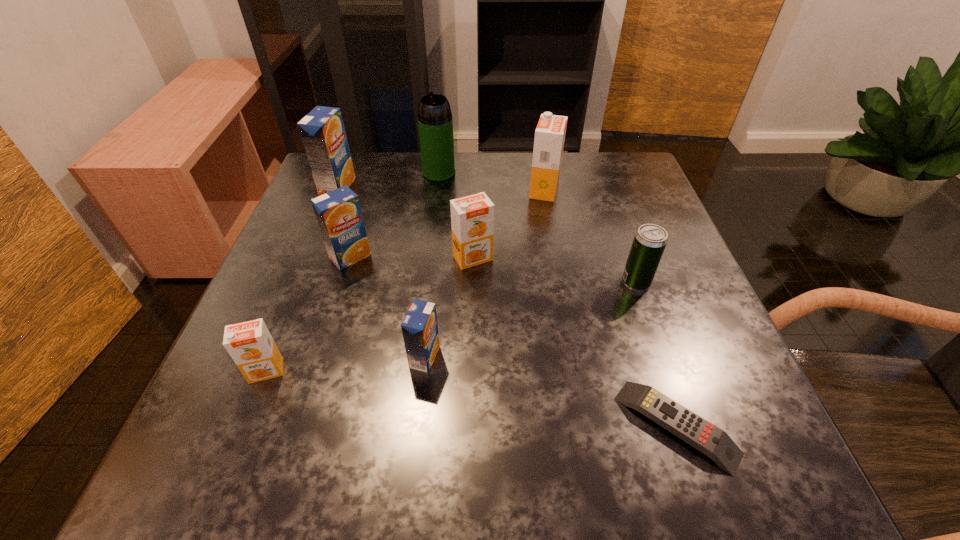
This screenshot has height=540, width=960. I want to click on the fifth closest object to the green thermos bottle, so click(650, 240).

This screenshot has width=960, height=540. I want to click on the third closest orange juice to the sixth farthest object, so click(x=419, y=328).

Find the location of a particular element. Image resolution: width=960 pixels, height=540 pixels. orange juice that is the third closest to the leftmost orange orange juice is located at coordinates (472, 217).

Image resolution: width=960 pixels, height=540 pixels. Find the location of `blue orange_juice that stands as the second closest to the beer can`. blue orange_juice that stands as the second closest to the beer can is located at coordinates (338, 213).

Where is `blue orange_juice that is the closest to the second smallest blue orange_juice`? This screenshot has width=960, height=540. blue orange_juice that is the closest to the second smallest blue orange_juice is located at coordinates (322, 131).

You are a GUI agent. You are given a task and a screenshot of the screen. Output one action in this format:
    pyautogui.click(x=<x>, y=<y>)
    Task: Click on the closest orange orange juice to the farthest orange orange juice
    
    Given the screenshot: What is the action you would take?
    pyautogui.click(x=472, y=217)

Find the location of a particular element. orange orange juice that stands as the second closest to the second blue orange_juice from right to left is located at coordinates (250, 344).

You are a GUI agent. You are given a task and a screenshot of the screen. Output one action in this format:
    pyautogui.click(x=<x>, y=<y>)
    Task: Click on the vacant area that satisfies the following two spatial constraints: 1. from the spout of the green thermos bottle; 2. on the left side of the second orange juice from right to left
    
    Given the screenshot: What is the action you would take?
    pyautogui.click(x=429, y=258)

Where is `vacant area in the image that satisfies the following two spatial constraints: 1. from the spout of the green thermos bottle; 2. on the left side of the remote control`? This screenshot has width=960, height=540. vacant area in the image that satisfies the following two spatial constraints: 1. from the spout of the green thermos bottle; 2. on the left side of the remote control is located at coordinates (409, 426).

At what (x,y) coordinates should I click in order to perform the action: click on free space in the image that satisfies the following two spatial constraints: 1. on the back side of the third orange juice from right to left; 2. on the left side of the beer can. Please return your answer as a coordinate pair (x, y). This screenshot has width=960, height=540. Looking at the image, I should click on pos(433,282).